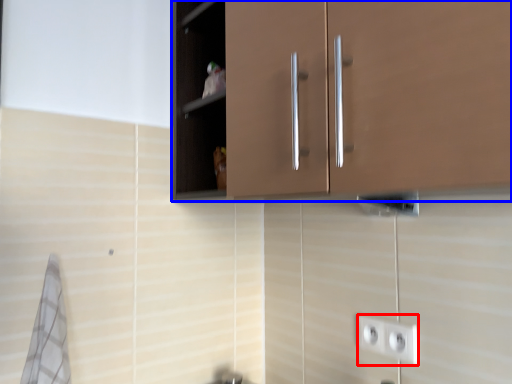
Question: Which object is closer to the camera taking this photo, socket (highlighted by a red box) or cabinetry (highlighted by a blue box)?

Choices:
 (A) socket
 (B) cabinetry

Answer: (B)